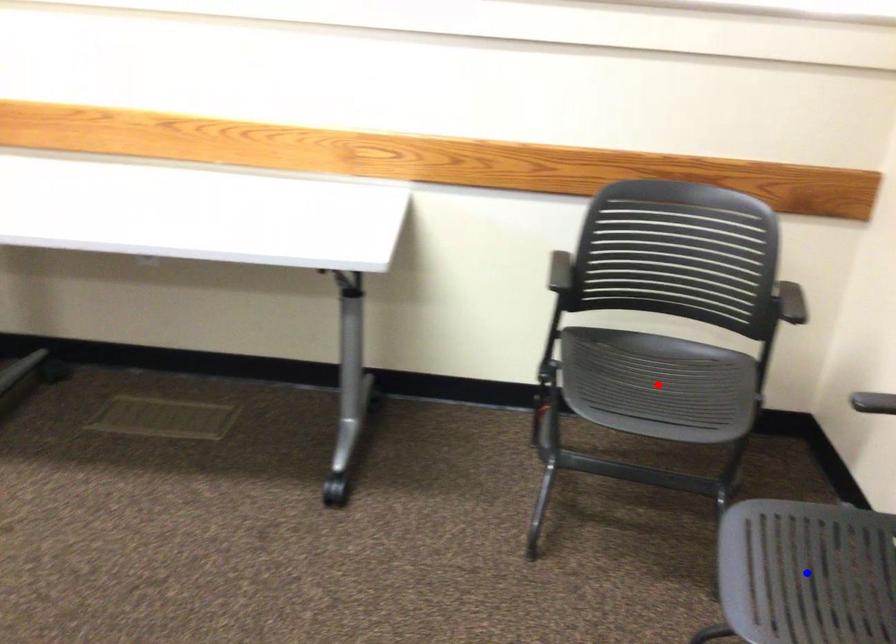
Question: In the image, two points are highlighted. Which point is nearer to the camera? Reply with the corresponding letter.

Choices:
 (A) blue point
 (B) red point

Answer: (A)